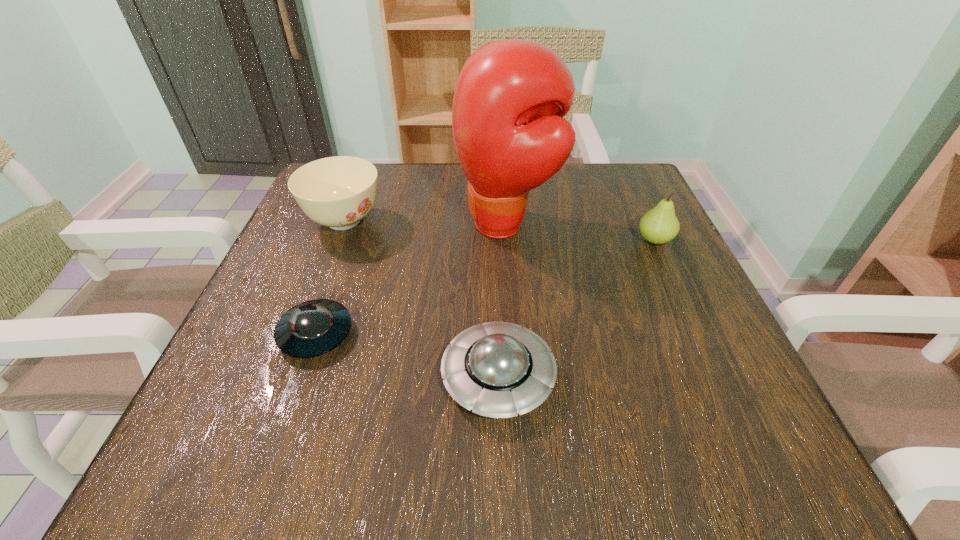
What are the coordinates of `boxing glove` in the screenshot? It's located at coord(511,95).

Where is `pear`? The width and height of the screenshot is (960, 540). pear is located at coordinates (659, 225).

Identify the location of sugar bowl. (338, 192).

The width and height of the screenshot is (960, 540). I want to click on the right saucer, so click(x=498, y=369).

This screenshot has height=540, width=960. I want to click on the taller saucer, so click(498, 369).

This screenshot has height=540, width=960. In order to click on the shortest object in this screenshot , I will do `click(311, 328)`.

The width and height of the screenshot is (960, 540). I want to click on the shorter saucer, so click(311, 328).

This screenshot has width=960, height=540. I want to click on vacant space located 0.110m on the striking surface of the tallest object, so click(x=404, y=225).

You are a GUI agent. You are given a task and a screenshot of the screen. Output one action in this format:
    pyautogui.click(x=<x>, y=<y>)
    Task: Click on the vacant space situated 0.090m on the striking surface of the tallest object
    
    Given the screenshot: What is the action you would take?
    pyautogui.click(x=414, y=225)

I want to click on vacant space located 0.320m on the striking surface of the tallest object, so click(x=305, y=225).